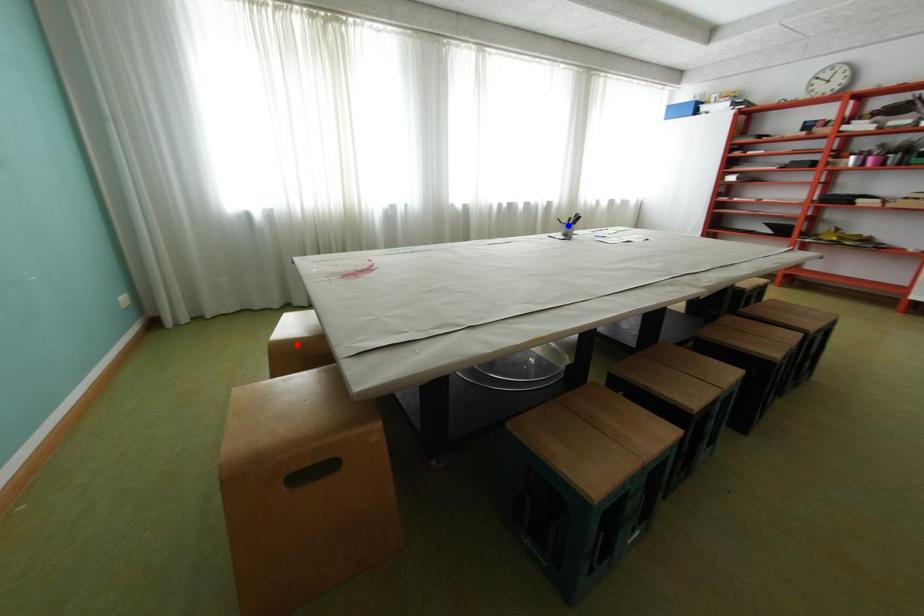
Question: Which of the two points in the image is closer to the camera?

Choices:
 (A) Blue point is closer.
 (B) Red point is closer.

Answer: (B)